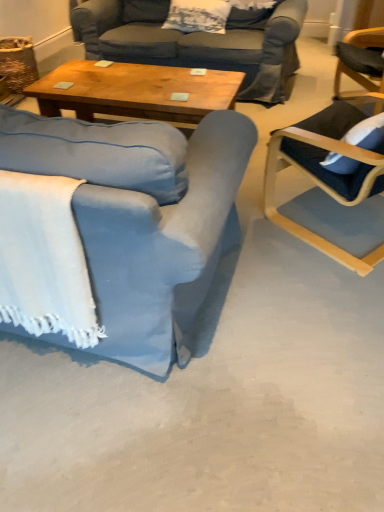
I want to click on vacant region below dark blue fabric chair at right, the 2th chair when ordered from left to right (from a real-world perspective), so click(334, 220).